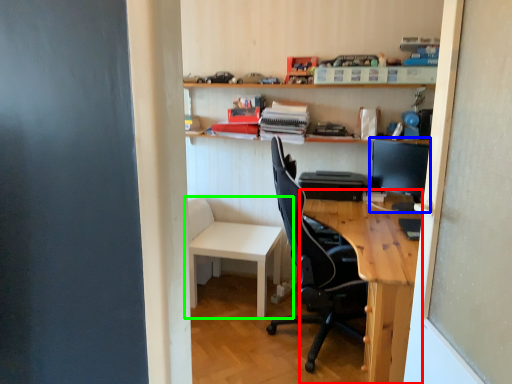
Question: Which object is the farthest from desk (highlighted by a red box)? Choose among these: computer monitor (highlighted by a blue box) or table (highlighted by a green box).

Choices:
 (A) computer monitor
 (B) table

Answer: (B)